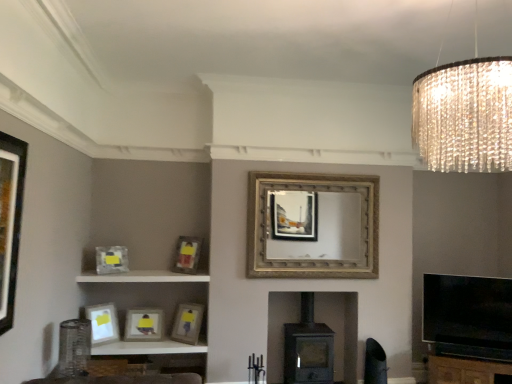
Question: From the image's perspective, is matte white picture frame at lower left, which appears as the sixth picture frame when viewed from the back, above matte gray picture frame at left, the 3th picture frame from the front?

Choices:
 (A) yes
 (B) no

Answer: (B)

Question: Considering the relative sizes of matte white picture frame at lower left, arranged as the 2th picture frame when viewed from the front, and matte gray picture frame at left, the fifth picture frame viewed from the back, in the image provided, is matte white picture frame at lower left, arranged as the 2th picture frame when viewed from the front, thinner than matte gray picture frame at left, the fifth picture frame viewed from the back,?

Choices:
 (A) no
 (B) yes

Answer: (A)

Question: Is matte white picture frame at lower left, the first picture frame viewed from the left, completely or partially outside of matte gray picture frame at left, the 3th picture frame from the front?

Choices:
 (A) yes
 (B) no

Answer: (A)

Question: Is matte white picture frame at lower left, which appears as the sixth picture frame when viewed from the back, in contact with matte gray picture frame at left, arranged as the sixth picture frame when viewed from the right?

Choices:
 (A) no
 (B) yes

Answer: (A)

Question: Is matte white picture frame at lower left, the first picture frame viewed from the left, taller than matte gray picture frame at left, the 2th picture frame in the left-to-right sequence?

Choices:
 (A) yes
 (B) no

Answer: (A)

Question: Looking at their shapes, would you say brown wooden dresser at lower right is wider or thinner than white glossy shelf at lower left?

Choices:
 (A) thin
 (B) wide

Answer: (B)

Question: From the image's perspective, is brown wooden dresser at lower right located above or below white glossy shelf at lower left?

Choices:
 (A) below
 (B) above

Answer: (A)

Question: Considering their positions, is brown wooden dresser at lower right located in front of or behind white glossy shelf at lower left?

Choices:
 (A) front
 (B) behind

Answer: (A)

Question: Is point (450, 360) closer or farther from the camera than point (150, 274)?

Choices:
 (A) closer
 (B) farther

Answer: (A)

Question: From a real-world perspective, is matte gray picture frame at left, the fifth picture frame viewed from the back, positioned above or below brown wooden dresser at lower right?

Choices:
 (A) above
 (B) below

Answer: (A)

Question: Is matte gray picture frame at left, arranged as the sixth picture frame when viewed from the right, wider or thinner than brown wooden dresser at lower right?

Choices:
 (A) wide
 (B) thin

Answer: (B)

Question: Would you say matte gray picture frame at left, the 3th picture frame from the front, is to the left or to the right of brown wooden dresser at lower right in the picture?

Choices:
 (A) right
 (B) left

Answer: (B)

Question: Is matte gray picture frame at left, the 2th picture frame in the left-to-right sequence, inside the boundaries of brown wooden dresser at lower right, or outside?

Choices:
 (A) inside
 (B) outside

Answer: (B)

Question: Is point (187, 342) closer or farther from the camera than point (458, 375)?

Choices:
 (A) closer
 (B) farther

Answer: (B)

Question: In terms of width, does matte wooden picture frame at lower center, which is the 2th picture frame in right-to-left order, look wider or thinner when compared to brown wooden dresser at lower right?

Choices:
 (A) wide
 (B) thin

Answer: (B)